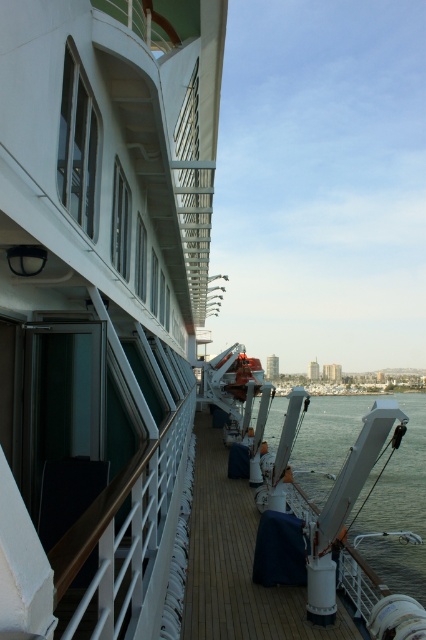
Consider the image. You are standing on the cruise ship deck and want to move from one point to another. You see two points marked on the deck as point 1 at coordinates point (264, 616) and point 2 at coordinates point (396, 499). Which point is closer to you?

Point (264, 616) is closer to the viewer than point (396, 499).

You are standing on the cruise ship deck and want to place a small potted plant. The plant requires a spot that is exactly at the coordinates point (236, 563). According to the image, what is located there?

The point (236, 563) is occupied by the matte white deck at center.

You are a passenger on the cruise ship and want to walk from the matte white deck at center to the white glossy water at center. Which direction should you move in?

You should move to the right because the matte white deck at center is to the left of the white glossy water at center, so moving right would bring you towards the water.